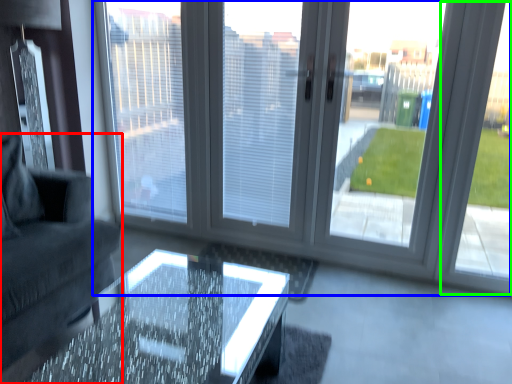
Question: Which object is positioned farthest from studio couch (highlighted by a red box)? Select from window (highlighted by a blue box) and window frame (highlighted by a green box).

Choices:
 (A) window
 (B) window frame

Answer: (B)